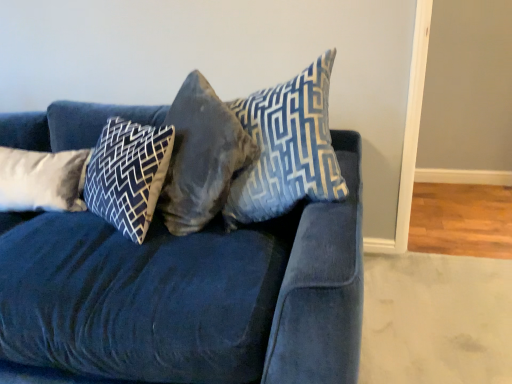
Question: From a real-world perspective, is velvet gray pillow at center, positioned as the 3th pillow in left-to-right order, beneath velvet blue couch at center?

Choices:
 (A) yes
 (B) no

Answer: (B)

Question: Is velvet gray pillow at center, positioned as the 3th pillow in left-to-right order, surrounding velvet blue couch at center?

Choices:
 (A) yes
 (B) no

Answer: (B)

Question: Is velvet gray pillow at center, positioned as the second pillow in right-to-left order, aimed at velvet blue couch at center?

Choices:
 (A) no
 (B) yes

Answer: (B)

Question: From a real-world perspective, is velvet gray pillow at center, positioned as the second pillow in right-to-left order, physically above velvet blue couch at center?

Choices:
 (A) no
 (B) yes

Answer: (B)

Question: Is the position of velvet gray pillow at center, positioned as the 3th pillow in left-to-right order, more distant than that of velvet blue couch at center?

Choices:
 (A) yes
 (B) no

Answer: (A)

Question: Is velvet gray pillow at center, positioned as the 3th pillow in left-to-right order, in front of or behind dark blue velvet pillow at center, which ranks as the 3th pillow in right-to-left order, in the image?

Choices:
 (A) behind
 (B) front

Answer: (B)

Question: In the image, is velvet gray pillow at center, positioned as the second pillow in right-to-left order, on the left side or the right side of dark blue velvet pillow at center, the 2th pillow when ordered from left to right?

Choices:
 (A) right
 (B) left

Answer: (A)

Question: Do you think velvet gray pillow at center, positioned as the second pillow in right-to-left order, is within dark blue velvet pillow at center, which ranks as the 3th pillow in right-to-left order, or outside of it?

Choices:
 (A) outside
 (B) inside

Answer: (A)

Question: From a real-world perspective, is velvet gray pillow at center, positioned as the second pillow in right-to-left order, physically located above or below dark blue velvet pillow at center, which ranks as the 3th pillow in right-to-left order?

Choices:
 (A) above
 (B) below

Answer: (A)

Question: Which is correct: dark blue velvet pillow at center, which ranks as the 3th pillow in right-to-left order, is inside white soft pillow at left, the 4th pillow positioned from the right, or outside of it?

Choices:
 (A) outside
 (B) inside

Answer: (A)

Question: From the image's perspective, relative to white soft pillow at left, the 4th pillow positioned from the right, is dark blue velvet pillow at center, which ranks as the 3th pillow in right-to-left order, above or below?

Choices:
 (A) above
 (B) below

Answer: (A)

Question: Looking at the image, does dark blue velvet pillow at center, the 2th pillow when ordered from left to right, seem bigger or smaller compared to white soft pillow at left, the 4th pillow positioned from the right?

Choices:
 (A) big
 (B) small

Answer: (A)

Question: Is point (102, 172) positioned closer to the camera than point (30, 192)?

Choices:
 (A) farther
 (B) closer

Answer: (B)

Question: From their relative heights in the image, would you say white soft pillow at left, arranged as the first pillow when viewed from the left, is taller or shorter than velvet blue couch at center?

Choices:
 (A) short
 (B) tall

Answer: (A)

Question: Does point (x=30, y=203) appear closer or farther from the camera than point (x=184, y=253)?

Choices:
 (A) closer
 (B) farther

Answer: (B)